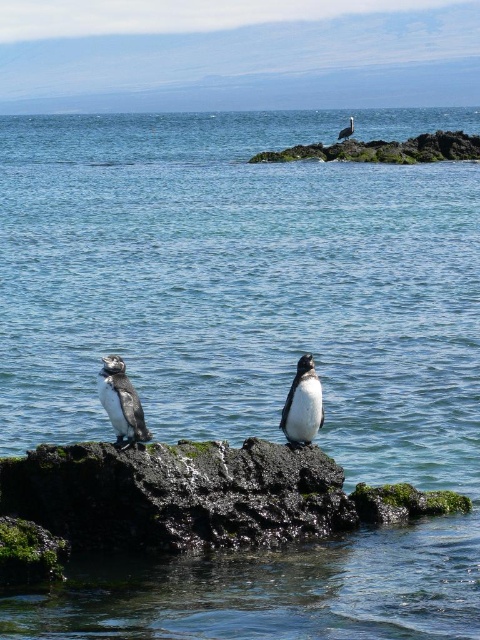
Question: Which point is farther from the camera taking this photo?

Choices:
 (A) (432, 154)
 (B) (348, 134)
 (C) (119, 364)

Answer: (B)

Question: Which of the following is the farthest from the observer?

Choices:
 (A) rough rock at upper right
 (B) white fluffy penguin at upper right
 (C) black matte penguin at center

Answer: (B)

Question: Based on their relative distances, which object is nearer to the rough rock at upper right?

Choices:
 (A) white fluffy penguin at upper right
 (B) black glossy penguin at center

Answer: (A)

Question: Is black matte penguin at center to the right of black glossy penguin at center from the viewer's perspective?

Choices:
 (A) no
 (B) yes

Answer: (A)

Question: Can you confirm if black matte penguin at center is positioned to the left of black glossy penguin at center?

Choices:
 (A) no
 (B) yes

Answer: (B)

Question: Does rough rock at upper right have a smaller size compared to white fluffy penguin at upper right?

Choices:
 (A) no
 (B) yes

Answer: (B)